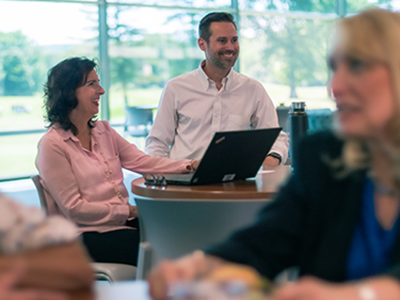
The width and height of the screenshot is (400, 300). In order to click on window trim in this screenshot , I will do `click(101, 35)`.